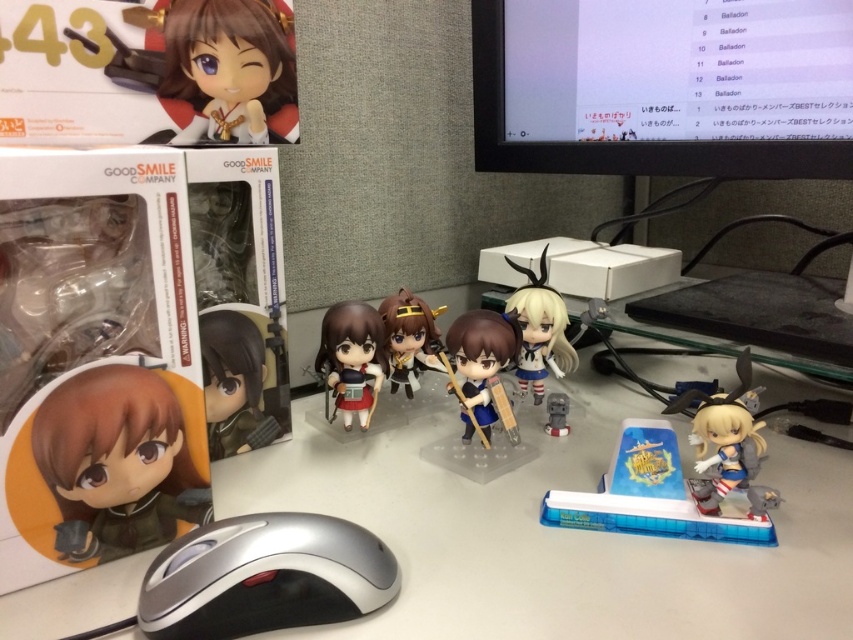
How distant is matte black figurine at center from matte gray toy at center?

matte black figurine at center is 8.59 inches away from matte gray toy at center.

Which of these two, matte black figurine at center or matte gray toy at center, stands shorter?

Standing shorter between the two is matte gray toy at center.

Does point (380, 324) come closer to viewer compared to point (553, 392)?

Yes, point (380, 324) is in front of point (553, 392).

The image size is (853, 640). I want to click on matte black figurine at center, so click(352, 358).

Locate an element on the screen. This screenshot has width=853, height=640. matte plastic doll at upper left is located at coordinates (227, 67).

Which is in front, point (213, 38) or point (560, 417)?

Point (213, 38) is in front.

Find the location of a particular element. The height and width of the screenshot is (640, 853). matte plastic doll at upper left is located at coordinates (227, 67).

Where is `matte black monitor at upper right`? matte black monitor at upper right is located at coordinates (663, 88).

Between point (782, 157) and point (575, 365), which one is positioned in front?

Positioned in front is point (782, 157).

Locate an element on the screen. The width and height of the screenshot is (853, 640). matte black monitor at upper right is located at coordinates (663, 88).